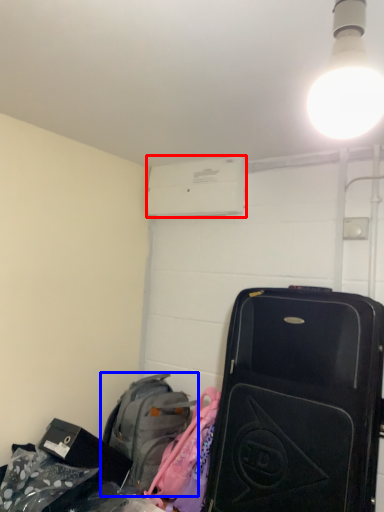
Question: Which object is further to the camera taking this photo, air conditioning (highlighted by a red box) or luggage and bags (highlighted by a blue box)?

Choices:
 (A) air conditioning
 (B) luggage and bags

Answer: (A)